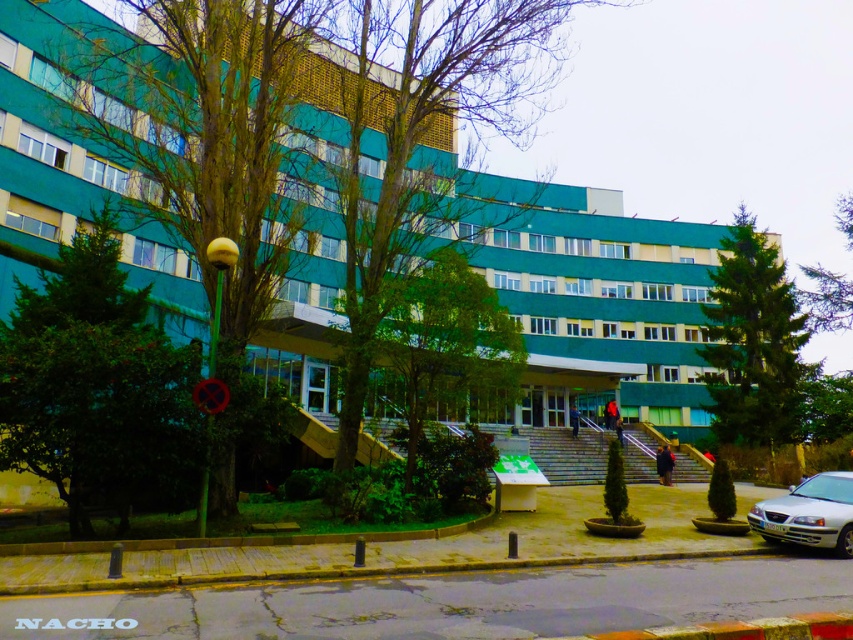
You are standing at the base of the stone steps in front of the building. There is a green glass building at center. If you look towards the point with coordinates (x=596, y=300), what object will you see there?

The point at coordinates (x=596, y=300) corresponds to the green glass building at center.

You are standing at the base of the stone steps in front of the green glass building at center. You want to take a photo of the building without any obstructions. Is the silver metallic car at lower right blocking your view of the building?

The green glass building at center is positioned over the silver metallic car at lower right, meaning the car is directly in front of the building from your viewpoint. This would block your view of the building, so you need to move to a different angle to take an unobstructed photo.